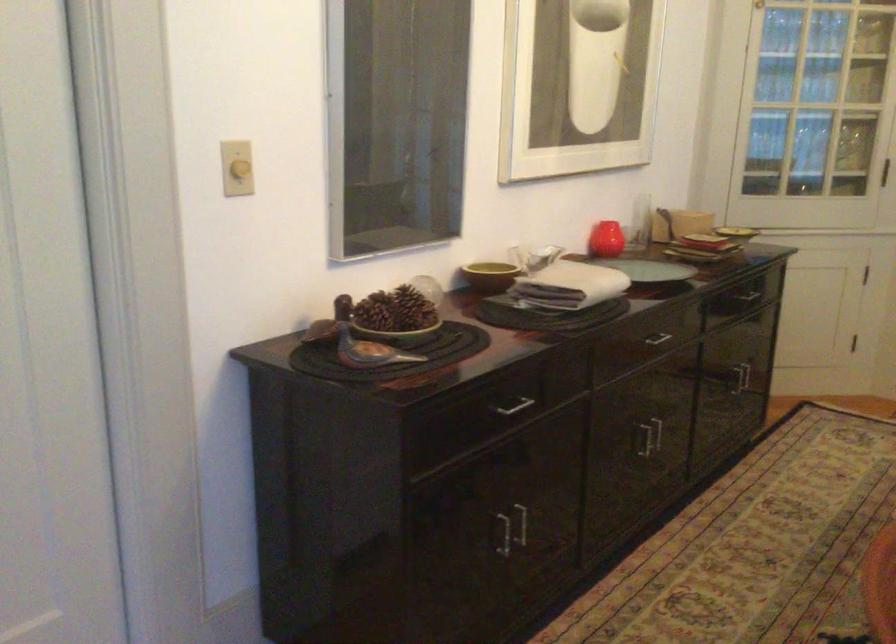
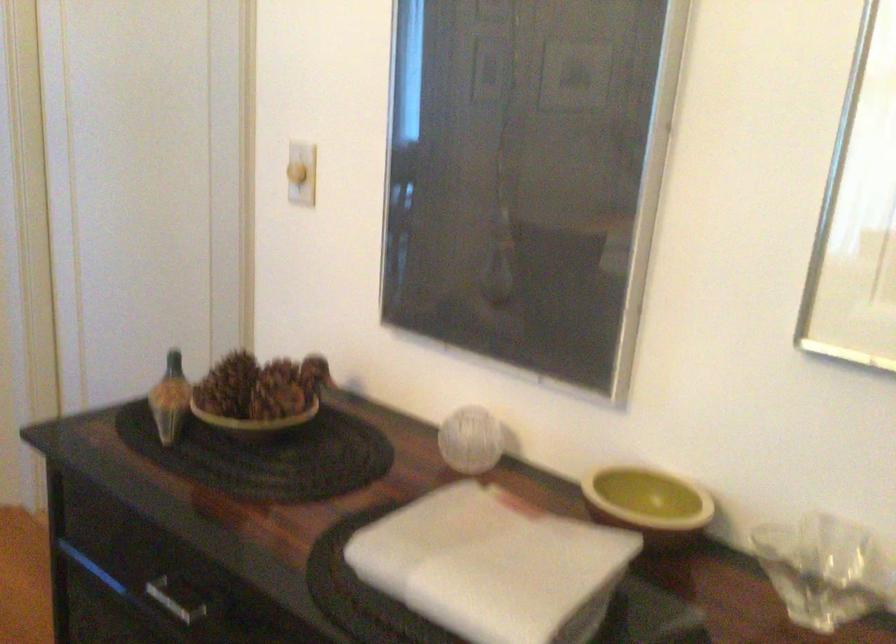
Find the pixel in the second image that matches (x=487, y=296) in the first image.

(648, 503)